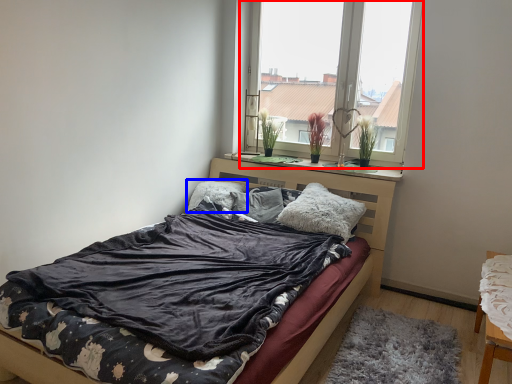
Question: Which object appears closest to the camera in this image, window (highlighted by a red box) or pillow (highlighted by a blue box)?

Choices:
 (A) window
 (B) pillow

Answer: (A)